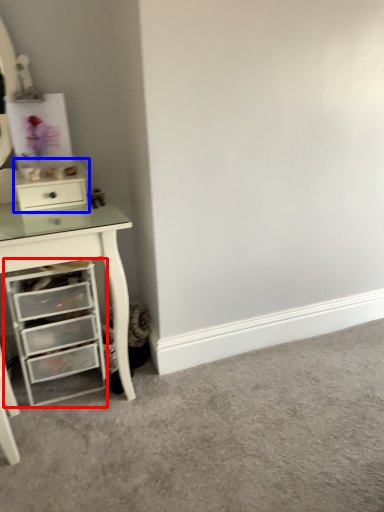
Question: Among these objects, which one is nearest to the camera, chest of drawers (highlighted by a red box) or file cabinet (highlighted by a blue box)?

Choices:
 (A) chest of drawers
 (B) file cabinet

Answer: (A)